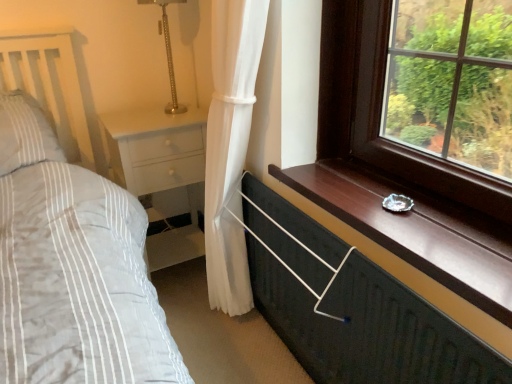
Question: Is metallic dark green chest of drawers at lower right situated inside gold textured table lamp at upper center or outside?

Choices:
 (A) outside
 (B) inside

Answer: (A)

Question: Is metallic dark green chest of drawers at lower right wider or thinner than gold textured table lamp at upper center?

Choices:
 (A) wide
 (B) thin

Answer: (B)

Question: Which is nearer to the metallic dark green chest of drawers at lower right?

Choices:
 (A) white glossy nightstand at lower left
 (B) gold textured table lamp at upper center

Answer: (A)

Question: Based on their relative distances, which object is farther from the metallic dark green chest of drawers at lower right?

Choices:
 (A) white glossy nightstand at lower left
 (B) gold textured table lamp at upper center

Answer: (B)